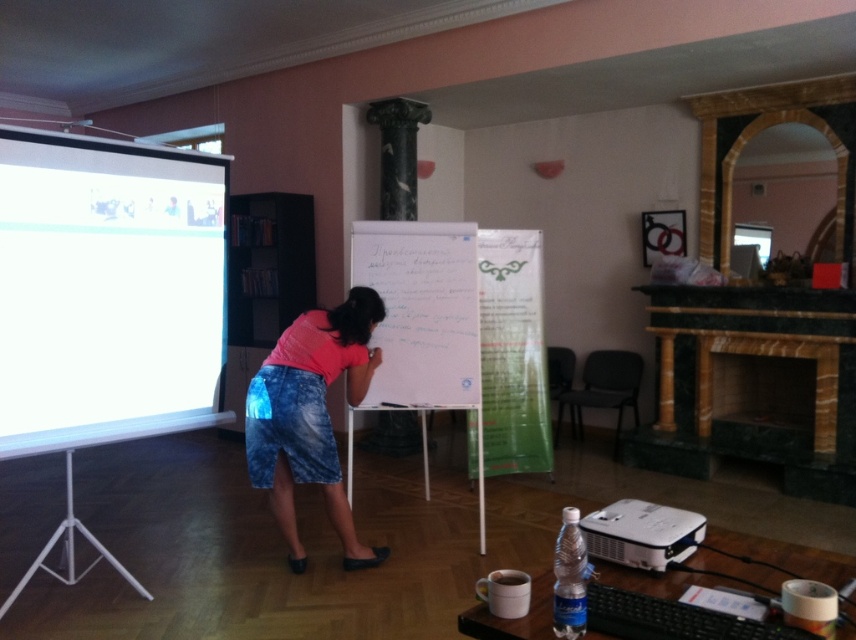
Where is the pink fabric skirt at center located in the image?

The pink fabric skirt at center is located at point 0.650 in the horizontal axis and 0.364 in the vertical axis.

You are setting up a presentation and need to adjust the height of the white plastic projector at lower right to match the whiteboard at center. Based on the scene description, will you need to raise or lower the projector?

The whiteboard at center is taller than the white plastic projector at lower right. To match their heights, you will need to raise the white plastic projector at lower right.